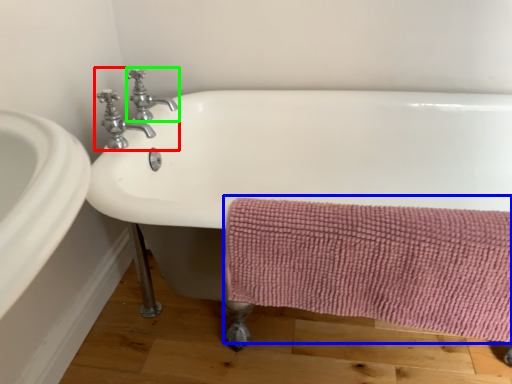
Question: Which object is positioned closest to tap (highlighted by a red box)? Select from bath towel (highlighted by a blue box) and tap (highlighted by a green box).

Choices:
 (A) bath towel
 (B) tap

Answer: (B)